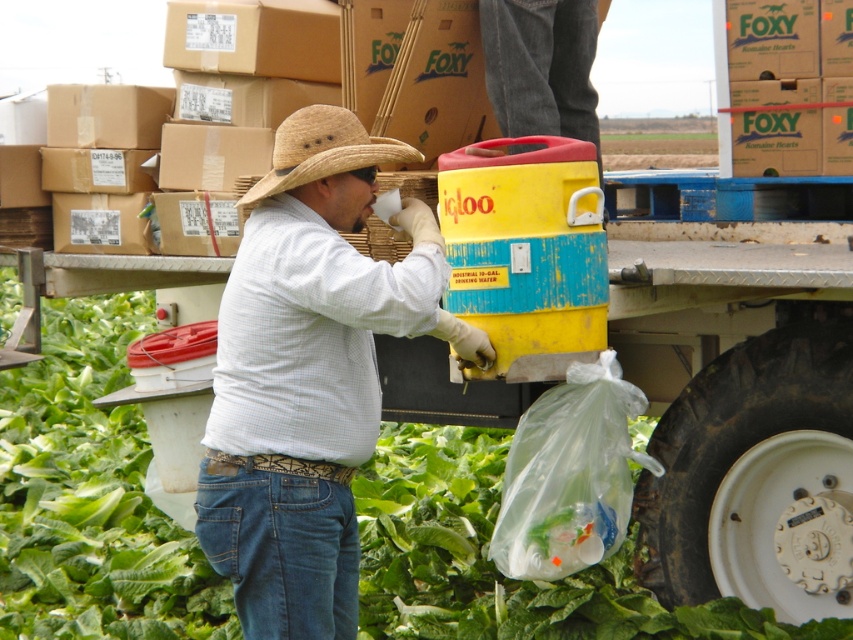
You are standing at the position of the man in the image. You want to walk to the point labeled point (576, 67). Which direction should you move relative to point (347, 147)?

Since point (576, 67) is behind point (347, 147), you should move in the direction away from point (347, 147) to reach point (576, 67).

You are a delivery person who needs to hand over a package to the man in the scene. The package must be placed within 5 feet of both the denim jeans at center and the straw hat at center. Can you place the package in a position that satisfies both distance requirements?

The denim jeans at center is 4.37 feet from the straw hat at center. Since 4.37 feet is less than 5 feet, the package can be placed anywhere between them within the 5 feet radius of both objects, so yes, it is possible to place the package in a position that satisfies both distance requirements.